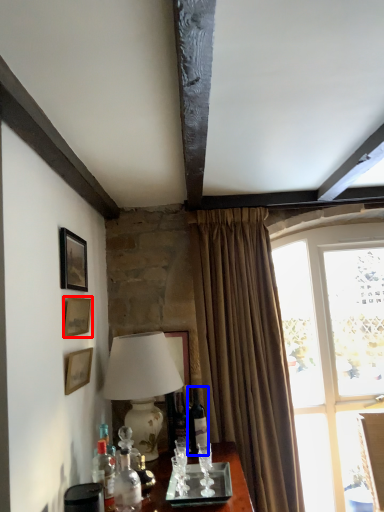
Question: Which point is further to the camera, picture frame (highlighted by a red box) or wine bottle (highlighted by a blue box)?

Choices:
 (A) picture frame
 (B) wine bottle

Answer: (B)